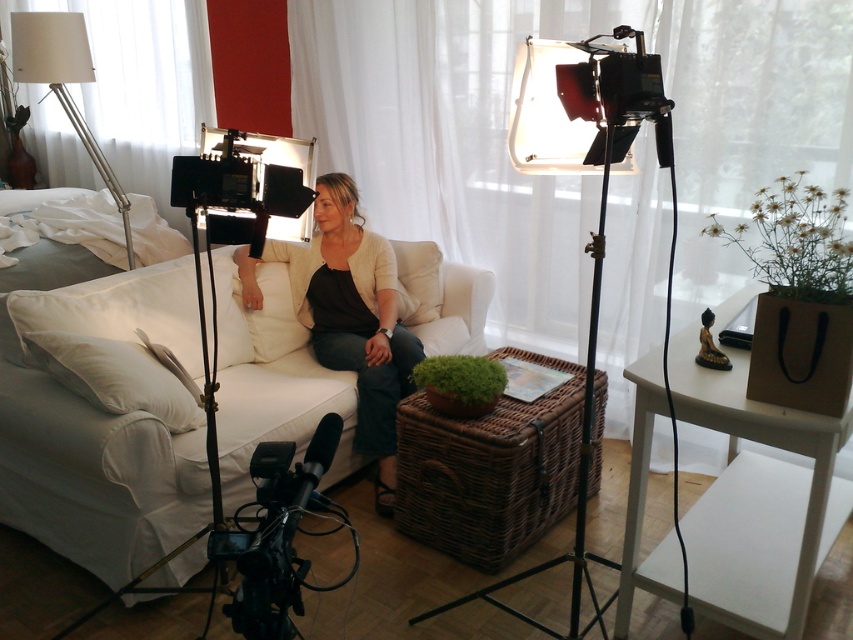
Question: Among these objects, which one is nearest to the camera?

Choices:
 (A) white fabric couch at center
 (B) white sheer curtain at upper center
 (C) white fabric lampshade at upper left
 (D) metallic tripod at center

Answer: (D)

Question: Does white sheer curtain at upper center appear over matte black sweater at center?

Choices:
 (A) yes
 (B) no

Answer: (A)

Question: Based on their relative distances, which object is farther from the white fabric lampshade at upper left?

Choices:
 (A) metallic tripod at center
 (B) white fabric couch at center

Answer: (A)

Question: Which point is farther to the camera?

Choices:
 (A) (341, 243)
 (B) (369, 211)

Answer: (B)

Question: Is metallic tripod at center smaller than white fabric lampshade at upper left?

Choices:
 (A) yes
 (B) no

Answer: (B)

Question: Is white sheer curtain at upper center bigger than matte black sweater at center?

Choices:
 (A) no
 (B) yes

Answer: (B)